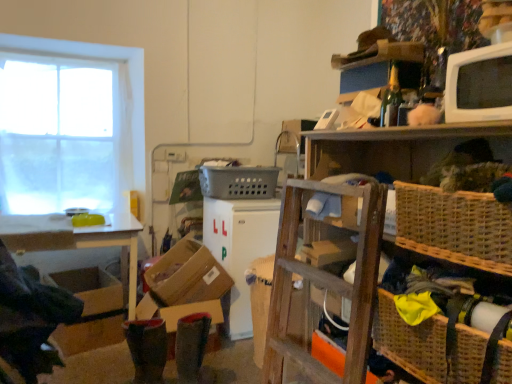
Question: Is brown cardboard box at lower center shorter than white sheer curtain at left?

Choices:
 (A) yes
 (B) no

Answer: (A)

Question: Is brown cardboard box at lower center positioned with its back to white sheer curtain at left?

Choices:
 (A) yes
 (B) no

Answer: (B)

Question: Is brown cardboard box at lower center taller than white sheer curtain at left?

Choices:
 (A) no
 (B) yes

Answer: (A)

Question: Is brown cardboard box at lower center oriented towards white sheer curtain at left?

Choices:
 (A) yes
 (B) no

Answer: (B)

Question: Is brown cardboard box at lower center surrounding white sheer curtain at left?

Choices:
 (A) no
 (B) yes

Answer: (A)

Question: In the image, is brown cardboard box at lower left on the left side or the right side of woven brown basket at right, the 2th basket from the top?

Choices:
 (A) right
 (B) left

Answer: (B)

Question: From the image's perspective, is brown cardboard box at lower left positioned above or below woven brown basket at right, marked as the 3th basket in a left-to-right arrangement?

Choices:
 (A) below
 (B) above

Answer: (A)

Question: Looking at their shapes, would you say brown cardboard box at lower left is wider or thinner than woven brown basket at right, positioned as the second basket in bottom-to-top order?

Choices:
 (A) wide
 (B) thin

Answer: (A)

Question: Do you think brown cardboard box at lower left is within woven brown basket at right, the 2th basket from the top, or outside of it?

Choices:
 (A) outside
 (B) inside

Answer: (A)

Question: Is point (503, 86) positioned closer to the camera than point (131, 67)?

Choices:
 (A) farther
 (B) closer

Answer: (B)

Question: In the image, is white glossy microwave at upper right, placed as the second appliance when sorted from back to front, positioned in front of or behind white sheer curtain at left?

Choices:
 (A) behind
 (B) front

Answer: (B)

Question: Looking at their shapes, would you say white glossy microwave at upper right, the first appliance viewed from the right, is wider or thinner than white sheer curtain at left?

Choices:
 (A) wide
 (B) thin

Answer: (A)

Question: From the image's perspective, relative to white sheer curtain at left, is white glossy microwave at upper right, the first appliance viewed from the right, above or below?

Choices:
 (A) above
 (B) below

Answer: (B)

Question: Is white glossy microwave at upper right, arranged as the 2th appliance when ordered from the bottom, bigger or smaller than brown cardboard box at lower left?

Choices:
 (A) big
 (B) small

Answer: (B)

Question: Is white glossy microwave at upper right, placed as the second appliance when sorted from back to front, situated inside brown cardboard box at lower left or outside?

Choices:
 (A) outside
 (B) inside

Answer: (A)